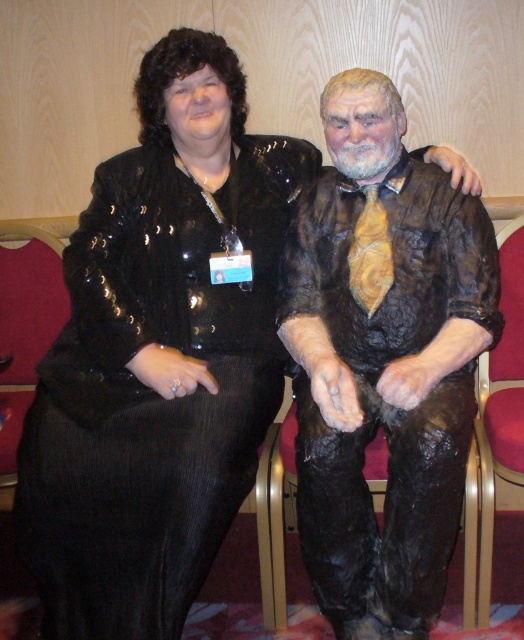
From the picture: You are an interior designer planning to place a new sculpture in this room. The sculpture requires a space that is at least 1 meter wide between it and the nearest furniture. Is the current placement of the brown textured statue at center and metallic gold armchair at right suitable for this requirement?

The brown textured statue at center is to the left of the metallic gold armchair at right, so the distance between them is not specified. However, since the statue is placed at the center and the armchair is at the right, there might be sufficient space between them to meet the 1 meter requirement. Without exact measurements, it is recommended to measure the actual distance before finalizing the placement.

You are a photographer at an event and need to capture a photo that includes both the black sequined dress at center and the brown textured statue at center. Since the statue is taller, where should you position the camera to ensure both are fully visible in the frame?

Since the black sequined dress at center is shorter than the brown textured statue at center, positioning the camera at a lower angle will ensure the entire statue is visible while still capturing the dress in the foreground.

In the scene shown: You are standing 5 feet away from the image. Is the point at coordinates point (x=180, y=524) closer to you than your current position?

The distance of point (x=180, y=524) from viewer is 4.81 feet, so yes, the point is closer to you than your current position of 5 feet.